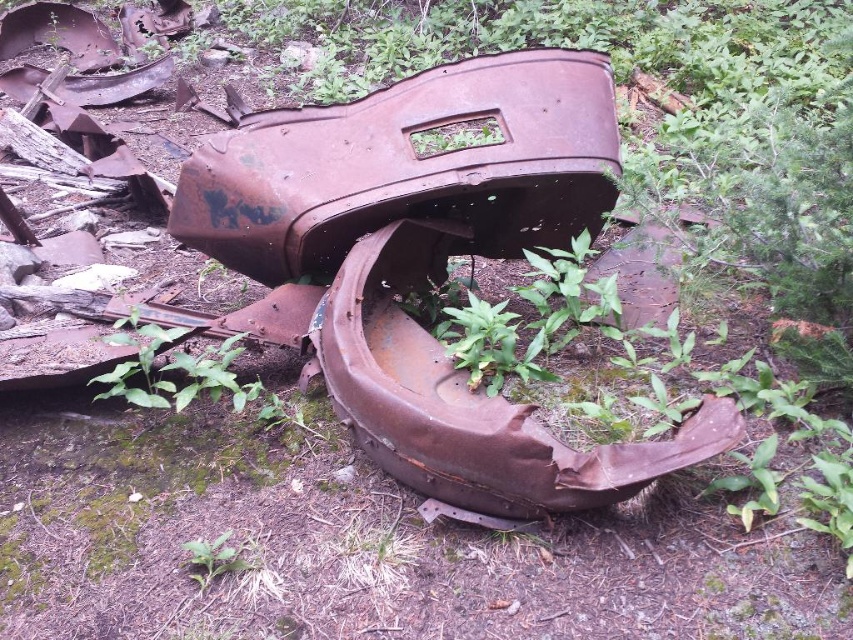
You are standing at the point closest to the front of the abandoned car trunk. Which coordinate point, point A at (595, 122) or point B at (231, 554), is farther away from you?

Point A at (595, 122) is farther away from you because it is behind point B at (231, 554).

You are a botanist studying the growth patterns of plants in abandoned areas. You notice the rusty metal car at center and the green leafy weed at lower center. Which object is positioned higher in the image?

The rusty metal car at center is above the green leafy weed at lower center, so it is positioned higher in the image.

You are standing 4.83 feet away from the rusty metal car at center. If you want to take a photo of it with your camera, which is positioned where you are standing, will you be able to capture the entire car in one shot without moving?

The distance between you and the rusty metal car at center is 4.83 feet. Whether the entire car can be captured depends on your camera lens. If the lens has a wide enough angle, it might fit. However, if the lens has a narrow angle, parts of the car might be cut off. The description does not provide the car size or camera specifications, so the answer is uncertain without that information.